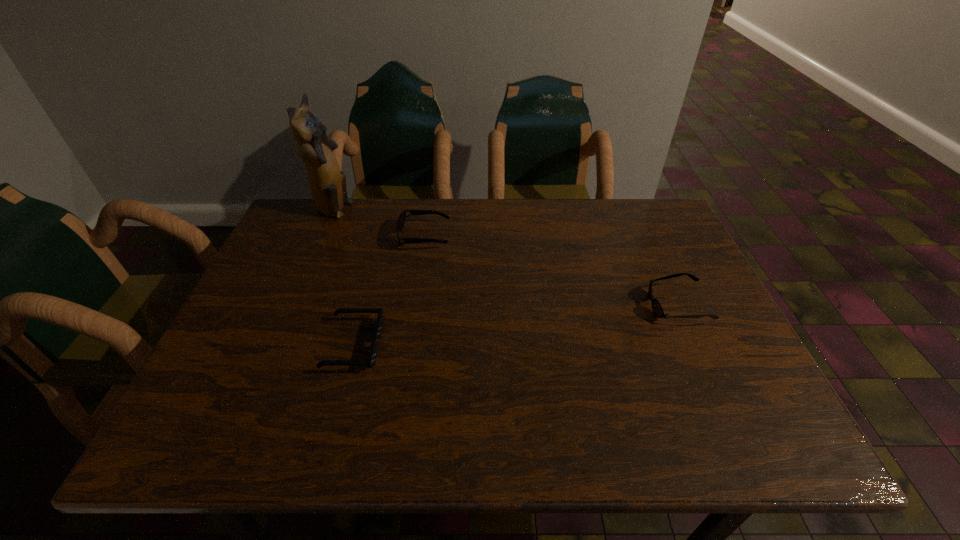
The width and height of the screenshot is (960, 540). I want to click on the farthest object, so click(327, 183).

The image size is (960, 540). Identify the location of cat. (327, 183).

Where is `the third nearest object`? This screenshot has width=960, height=540. the third nearest object is located at coordinates (402, 217).

At what (x,y) coordinates should I click in order to perform the action: click on the rightmost sunglasses. Please return your answer as a coordinate pair (x, y). The height and width of the screenshot is (540, 960). Looking at the image, I should click on (657, 308).

Locate an element on the screen. The height and width of the screenshot is (540, 960). the shortest object is located at coordinates (373, 352).

Locate an element on the screen. This screenshot has height=540, width=960. blank space located on the face of the cat is located at coordinates (476, 211).

At what (x,y) coordinates should I click in order to perform the action: click on free space located 0.300m on the front-facing side of the farthest sunglasses. Please return your answer as a coordinate pair (x, y). Looking at the image, I should click on (554, 236).

Locate an element on the screen. The height and width of the screenshot is (540, 960). vacant space located 0.180m on the lenses of the rightmost object is located at coordinates (573, 306).

Where is `vacant space located 0.110m on the lenses of the rightmost object`? Image resolution: width=960 pixels, height=540 pixels. vacant space located 0.110m on the lenses of the rightmost object is located at coordinates (603, 306).

Image resolution: width=960 pixels, height=540 pixels. I want to click on free space located 0.250m on the lenses of the rightmost object, so click(544, 306).